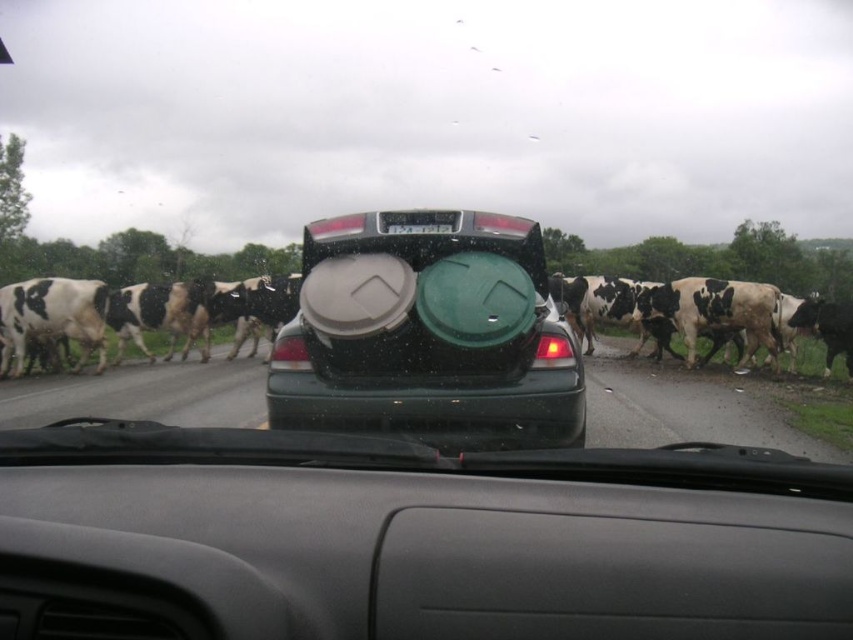
Locate an element on the screen. matte plastic trash can at center is located at coordinates (x=428, y=333).